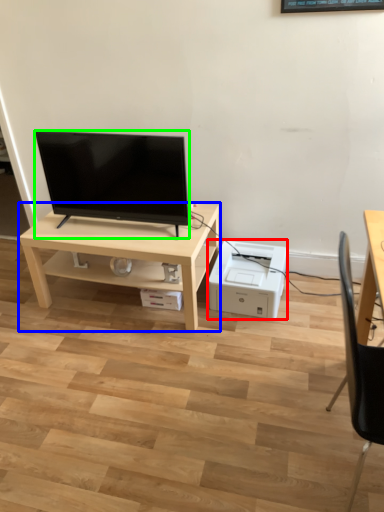
Question: Which object is positioned closest to printer (highlighted by a red box)? Select from table (highlighted by a blue box) and television (highlighted by a green box).

Choices:
 (A) table
 (B) television

Answer: (A)